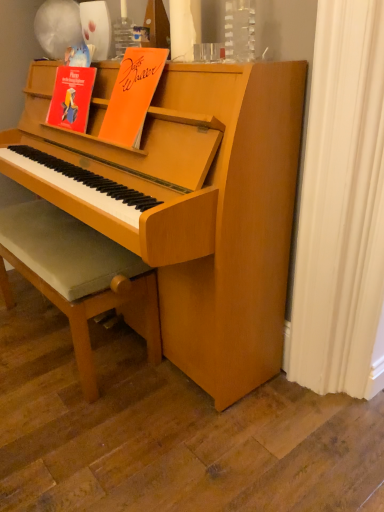
Find the location of a particular element. This screenshot has width=384, height=512. free point above light brown wooden footrest at lower left (from a real-world perspective) is located at coordinates (56, 227).